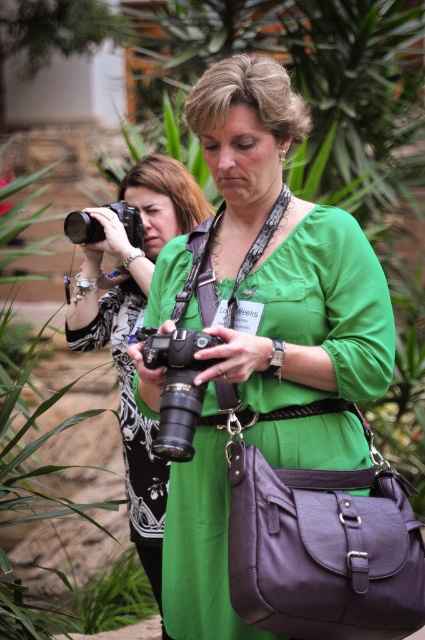
You are a photographer trying to locate your matte black camera. You remember it was placed at a specific coordinate in the image. Can you confirm if the point at coordinate point [133,326] is on the matte black camera at center?

Yes, the point at coordinate point [133,326] is on the matte black camera at center according to the provided information.

You are a photographer at a conference and you want to find the green matte dress at center. What are the coordinates where you can locate it?

The green matte dress at center can be located at coordinates point (320, 310).